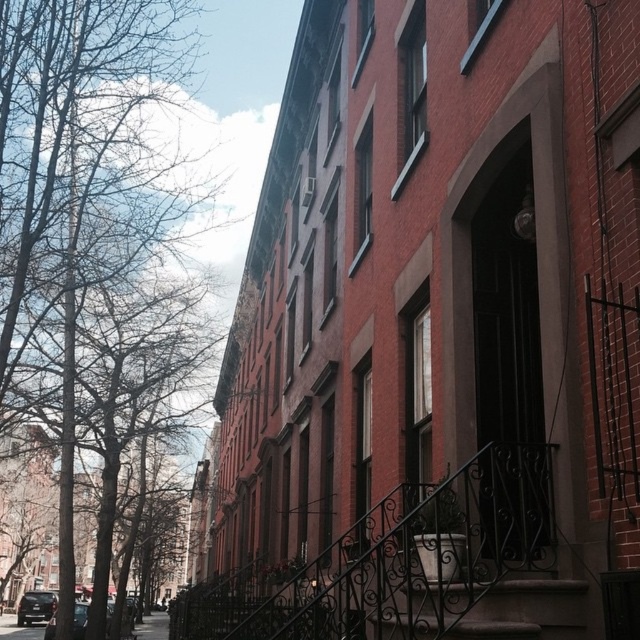
You are standing at a point 24.78 feet away from the camera, which is located at point (76, 198). You want to take a photo of the row of brick townhouses. Will you be able to capture the entire row in one shot if your camera has a 50mm lens?

The point at (76, 198) is 24.78 feet away from the camera. With a 50mm lens, which has a standard field of view, you may need to adjust your position or use a wider lens to ensure the entire row of brick townhouses fits in the frame.

You are standing at the corner of the street where the row of brick townhouses begins. You need to cross the road to reach the other side. The concrete pavement at lower left and the shiny black car at lower left are both in your line of sight. Which object is closer to you as you prepare to cross?

The concrete pavement at lower left is closer to you since it is only 21.03 feet away from the shiny black car at lower left, meaning the pavement is nearer to your current position.